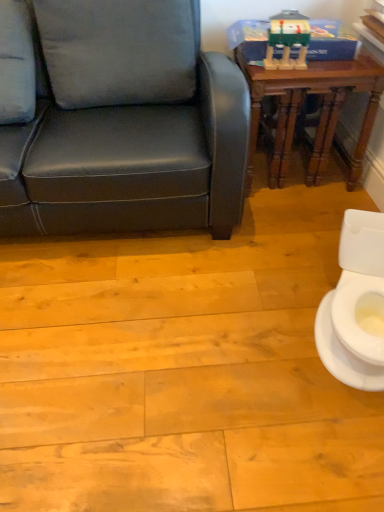
The image size is (384, 512). I want to click on white glossy toilet at lower right, so click(356, 306).

Describe the element at coordinates (16, 64) in the screenshot. This screenshot has width=384, height=512. I see `white fabric pillow at upper left` at that location.

The width and height of the screenshot is (384, 512). I want to click on wooden table at upper right, so click(321, 111).

You are a GUI agent. You are given a task and a screenshot of the screen. Output one action in this format:
    pyautogui.click(x=<x>, y=<y>)
    Task: Click on the matte green plastic toy at upper right
    The width and height of the screenshot is (384, 512).
    Given the screenshot: What is the action you would take?
    pyautogui.click(x=287, y=40)

Is matte green plastic toy at upper right aimed at white glossy toilet at lower right?

No, matte green plastic toy at upper right does not turn towards white glossy toilet at lower right.

Which is less distant, [300,40] or [342,285]?

The point [342,285] is closer to the camera.

From the picture: What's the angular difference between matte green plastic toy at upper right and white glossy toilet at lower right's facing directions?

matte green plastic toy at upper right and white glossy toilet at lower right are facing 23.4 degrees away from each other.

Between matte green plastic toy at upper right and white glossy toilet at lower right, which one is positioned behind?

matte green plastic toy at upper right is further from the camera.

Does white glossy toilet at lower right turn towards matte green plastic toy at upper right?

No, white glossy toilet at lower right is not oriented towards matte green plastic toy at upper right.

Between point (340, 293) and point (300, 61), which one is positioned in front?

The point (340, 293) is closer.

Is matte green plastic toy at upper right located within white glossy toilet at lower right?

That's incorrect, matte green plastic toy at upper right is not inside white glossy toilet at lower right.

Is white glossy toilet at lower right completely or partially outside of wooden table at upper right?

That's correct, white glossy toilet at lower right is outside of wooden table at upper right.

Is white glossy toilet at lower right next to wooden table at upper right and touching it?

white glossy toilet at lower right and wooden table at upper right are clearly separated.

Who is smaller, white glossy toilet at lower right or wooden table at upper right?

With smaller size is white glossy toilet at lower right.

Which of these two, white glossy toilet at lower right or wooden table at upper right, is wider?

wooden table at upper right is wider.

Which is farther, (x=8, y=106) or (x=326, y=337)?

Point (x=8, y=106)

From a real-world perspective, is white fabric pillow at upper left on top of white glossy toilet at lower right?

Yes, from a real-world perspective, white fabric pillow at upper left is on top of white glossy toilet at lower right.

Is the depth of white fabric pillow at upper left greater than that of white glossy toilet at lower right?

Yes, white fabric pillow at upper left is behind white glossy toilet at lower right.

Which is more to the right, white fabric pillow at upper left or white glossy toilet at lower right?

white glossy toilet at lower right is more to the right.

Is white fabric pillow at upper left taller than wooden table at upper right?

In fact, white fabric pillow at upper left may be shorter than wooden table at upper right.

How many degrees apart are the facing directions of white fabric pillow at upper left and wooden table at upper right?

The angle between the facing direction of white fabric pillow at upper left and the facing direction of wooden table at upper right is 0.349 degrees.

Where is `table located behind the white fabric pillow at upper left`? The height and width of the screenshot is (512, 384). table located behind the white fabric pillow at upper left is located at coordinates (321, 111).

Considering the relative sizes of white fabric pillow at upper left and wooden table at upper right in the image provided, is white fabric pillow at upper left smaller than wooden table at upper right?

Correct, white fabric pillow at upper left occupies less space than wooden table at upper right.

Considering the sizes of objects wooden table at upper right and white glossy toilet at lower right in the image provided, who is wider, wooden table at upper right or white glossy toilet at lower right?

Wider between the two is wooden table at upper right.

From the picture: From a real-world perspective, is wooden table at upper right positioned above or below white glossy toilet at lower right?

From a real-world perspective, wooden table at upper right is physically above white glossy toilet at lower right.

Which is more distant, (315, 166) or (324, 339)?

Point (315, 166)

Is wooden table at upper right oriented away from white glossy toilet at lower right?

wooden table at upper right is not turned away from white glossy toilet at lower right.

Is white fabric pillow at upper left surrounded by white glossy toilet at lower right?

No, white fabric pillow at upper left is located outside of white glossy toilet at lower right.

Is white glossy toilet at lower right in front of or behind white fabric pillow at upper left in the image?

white glossy toilet at lower right is in front of white fabric pillow at upper left.

Does white glossy toilet at lower right have a lesser width compared to white fabric pillow at upper left?

Yes, white glossy toilet at lower right is thinner than white fabric pillow at upper left.

Between point (374, 368) and point (9, 60), which one is positioned behind?

The point (9, 60) is farther from the camera.

Identify the location of toilet on the right of matte green plastic toy at upper right. The image size is (384, 512). (356, 306).

This screenshot has height=512, width=384. I want to click on toilet in front of the matte green plastic toy at upper right, so click(x=356, y=306).

Which object lies nearer to the anchor point matte green plastic toy at upper right, white fabric pillow at upper left or white glossy toilet at lower right?

white glossy toilet at lower right.

Estimate the real-world distances between objects in this image. Which object is closer to white glossy toilet at lower right, wooden table at upper right or white fabric pillow at upper left?

wooden table at upper right.

Based on their spatial positions, is white glossy toilet at lower right or matte green plastic toy at upper right further from wooden table at upper right?

white glossy toilet at lower right.

Based on their spatial positions, is wooden table at upper right or matte green plastic toy at upper right further from white fabric pillow at upper left?

wooden table at upper right is positioned further to the anchor white fabric pillow at upper left.

Based on the photo, which object lies nearer to the anchor point white glossy toilet at lower right, matte green plastic toy at upper right or white fabric pillow at upper left?

matte green plastic toy at upper right is positioned closer to the anchor white glossy toilet at lower right.

From the image, which object appears to be farther from white fabric pillow at upper left, white glossy toilet at lower right or matte green plastic toy at upper right?

Among the two, white glossy toilet at lower right is located further to white fabric pillow at upper left.

Considering their positions, is white fabric pillow at upper left positioned closer to wooden table at upper right than matte green plastic toy at upper right?

matte green plastic toy at upper right lies closer to wooden table at upper right than the other object.

Based on their spatial positions, is wooden table at upper right or white fabric pillow at upper left further from matte green plastic toy at upper right?

white fabric pillow at upper left.

Identify the location of toy situated between white fabric pillow at upper left and white glossy toilet at lower right from left to right. (287, 40).

Where is `table between matte green plastic toy at upper right and white glossy toilet at lower right vertically`? This screenshot has height=512, width=384. table between matte green plastic toy at upper right and white glossy toilet at lower right vertically is located at coordinates (321, 111).

Image resolution: width=384 pixels, height=512 pixels. Find the location of `table located between white fabric pillow at upper left and white glossy toilet at lower right in the left-right direction`. table located between white fabric pillow at upper left and white glossy toilet at lower right in the left-right direction is located at coordinates (321, 111).

Where is `toy between white fabric pillow at upper left and wooden table at upper right in the horizontal direction`? The image size is (384, 512). toy between white fabric pillow at upper left and wooden table at upper right in the horizontal direction is located at coordinates (287, 40).